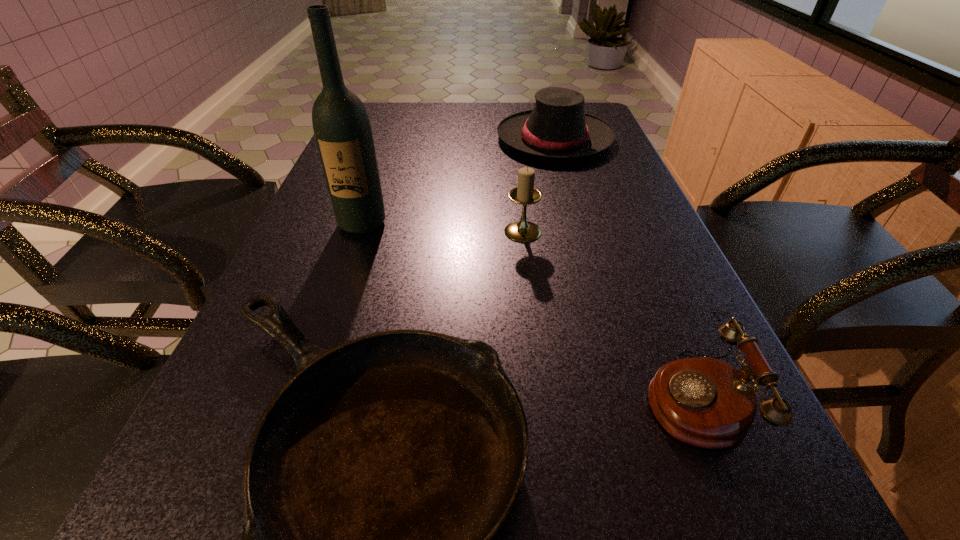
Identify the location of object that is at the far edge. The height and width of the screenshot is (540, 960). (557, 127).

Image resolution: width=960 pixels, height=540 pixels. I want to click on object that is at the left edge, so click(341, 125).

Identify the location of dress hat at the right edge. Image resolution: width=960 pixels, height=540 pixels. (557, 127).

In order to click on telephone that is positioned at the right edge in this screenshot , I will do `click(702, 401)`.

The height and width of the screenshot is (540, 960). In order to click on object positioned at the far right corner in this screenshot , I will do `click(557, 127)`.

You are a GUI agent. You are given a task and a screenshot of the screen. Output one action in this format:
    pyautogui.click(x=<x>, y=<y>)
    Task: Click on the free region at the far edge
    Image resolution: width=960 pixels, height=540 pixels.
    Given the screenshot: What is the action you would take?
    pyautogui.click(x=519, y=104)

The width and height of the screenshot is (960, 540). In order to click on free spot at the right edge of the desktop in this screenshot , I will do `click(586, 211)`.

Find the location of `blank space at the far right corner of the desktop`. blank space at the far right corner of the desktop is located at coordinates (594, 107).

The image size is (960, 540). I want to click on blank region between the candle holder and the dress hat, so click(539, 185).

This screenshot has height=540, width=960. Identify the location of free spot between the second tallest object and the dress hat. (539, 185).